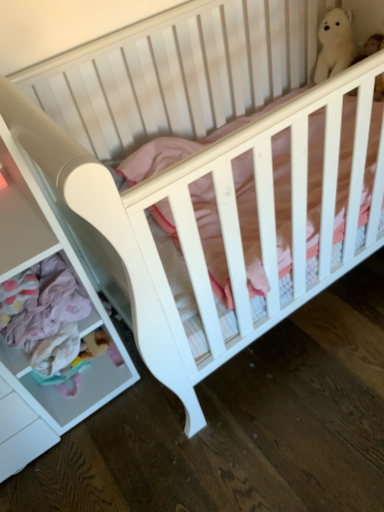
Question: From the image's perspective, is white plush bear at upper right over white plastic drawer at lower left?

Choices:
 (A) no
 (B) yes

Answer: (B)

Question: From a real-world perspective, is white plush bear at upper right physically above white plastic drawer at lower left?

Choices:
 (A) yes
 (B) no

Answer: (A)

Question: Is white plush bear at upper right bigger than white plastic drawer at lower left?

Choices:
 (A) yes
 (B) no

Answer: (B)

Question: Is white plush bear at upper right further to camera compared to white plastic drawer at lower left?

Choices:
 (A) yes
 (B) no

Answer: (A)

Question: Is white plush bear at upper right closer to camera compared to white plastic drawer at lower left?

Choices:
 (A) no
 (B) yes

Answer: (A)

Question: Considering the relative sizes of white plush bear at upper right and white plastic drawer at lower left in the image provided, is white plush bear at upper right thinner than white plastic drawer at lower left?

Choices:
 (A) no
 (B) yes

Answer: (B)

Question: Is white plastic drawer at lower left positioned before white plush bear at upper right?

Choices:
 (A) yes
 (B) no

Answer: (A)

Question: Is white plastic drawer at lower left taller than white plush bear at upper right?

Choices:
 (A) no
 (B) yes

Answer: (B)

Question: Is white plastic drawer at lower left bigger than white plush bear at upper right?

Choices:
 (A) yes
 (B) no

Answer: (A)

Question: Is white plastic drawer at lower left facing towards white plush bear at upper right?

Choices:
 (A) yes
 (B) no

Answer: (B)

Question: Is white plastic drawer at lower left smaller than white plush bear at upper right?

Choices:
 (A) no
 (B) yes

Answer: (A)

Question: Can you confirm if white plastic drawer at lower left is wider than white plush bear at upper right?

Choices:
 (A) no
 (B) yes

Answer: (B)

Question: From a real-world perspective, is white plush bear at upper right positioned above or below white plastic drawer at lower left?

Choices:
 (A) above
 (B) below

Answer: (A)